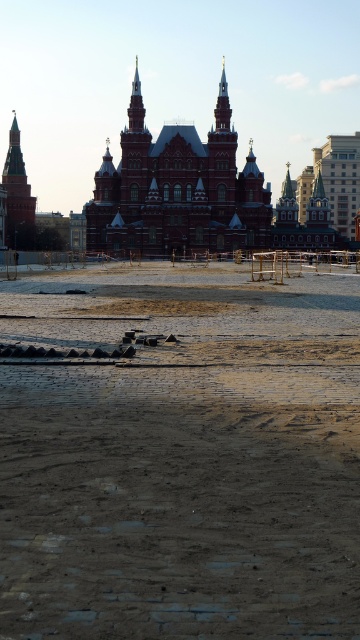
You are standing at the construction site in front of the ornate building. You notice a specific point marked at coordinates (177, 188). What is located at that point?

At point (177, 188) lies the red brick building at center.

You are a construction worker standing on the brown sandy ground at center. You need to reach the top of the brick tower at left for a safety inspection. What obstacle related to their heights might you encounter?

The brick tower at left is taller than the brown sandy ground at center, so you will need to climb up to reach the top of the brick tower at left from the brown sandy ground at center.

You are standing in front of the construction site and want to take a photo of the red brick building at center and the brick tower at left. Which one should you focus on first to ensure both are in the frame?

You should focus on the red brick building at center first because it is in front of the brick tower at left, so adjusting the camera to include the closer object ensures the background one will also be captured.